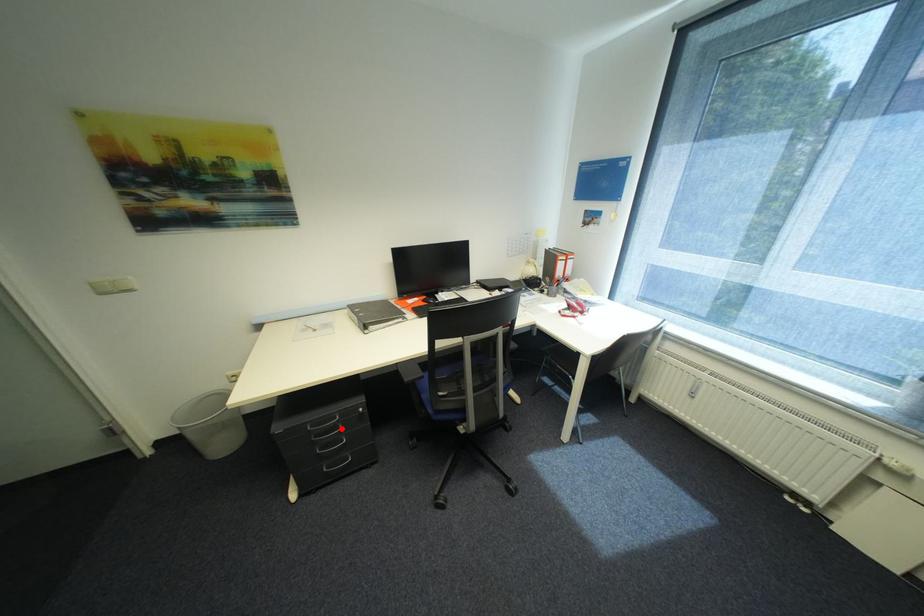
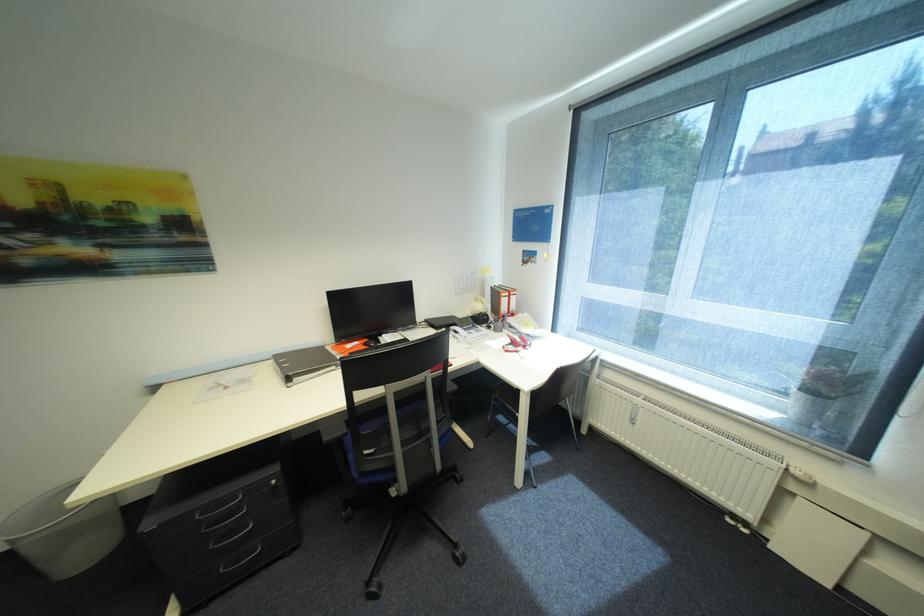
Question: I am providing you with two images of the same scene from different viewpoints. In image1, a red point is highlighted. Considering the same 3D point in image2, which of the following is correct?

Choices:
 (A) It is closer
 (B) It is farther

Answer: (A)